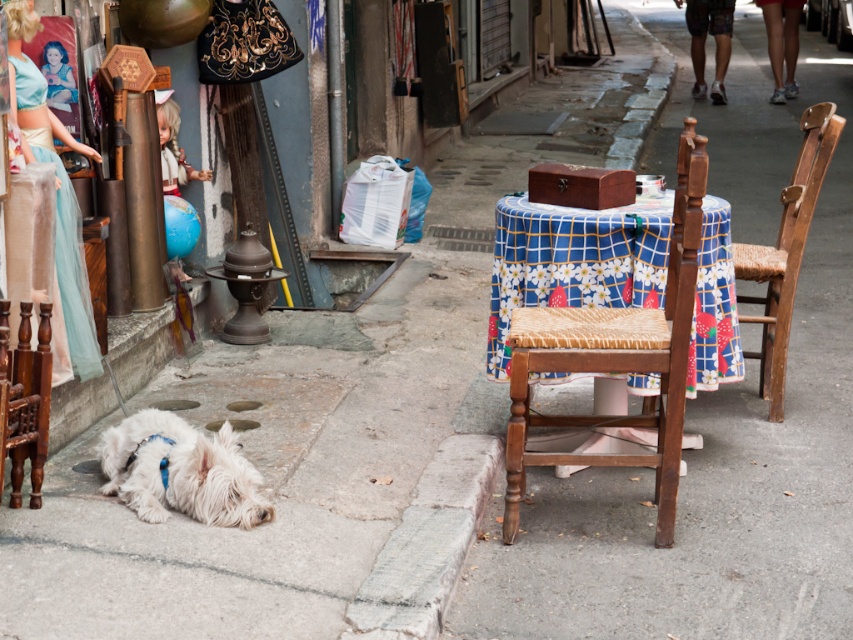
Is point (397, 552) positioned behind point (120, 438)?

No, it is in front of (120, 438).

Consider the image. Does gray concrete curb at lower center have a greater height compared to white fluffy dog at lower left?

Indeed, gray concrete curb at lower center has a greater height compared to white fluffy dog at lower left.

You are a GUI agent. You are given a task and a screenshot of the screen. Output one action in this format:
    pyautogui.click(x=<x>, y=<y>)
    Task: Click on the gray concrete curb at lower center
    
    Given the screenshot: What is the action you would take?
    pyautogui.click(x=427, y=545)

Can you confirm if blue floral tablecloth at center is wider than gray concrete curb at lower center?

Correct, the width of blue floral tablecloth at center exceeds that of gray concrete curb at lower center.

Who is taller, blue floral tablecloth at center or gray concrete curb at lower center?

Standing taller between the two is blue floral tablecloth at center.

Where is `blue floral tablecloth at center`? blue floral tablecloth at center is located at coordinates (573, 260).

Locate an element on the screen. blue floral tablecloth at center is located at coordinates (573, 260).

Is smooth concrete pavement at lower center thinner than blue floral tablecloth at center?

No.

In the scene shown: Who is shorter, smooth concrete pavement at lower center or blue floral tablecloth at center?

blue floral tablecloth at center

This screenshot has width=853, height=640. What do you see at coordinates (712, 420) in the screenshot?
I see `smooth concrete pavement at lower center` at bounding box center [712, 420].

Locate an element on the screen. The width and height of the screenshot is (853, 640). smooth concrete pavement at lower center is located at coordinates (712, 420).